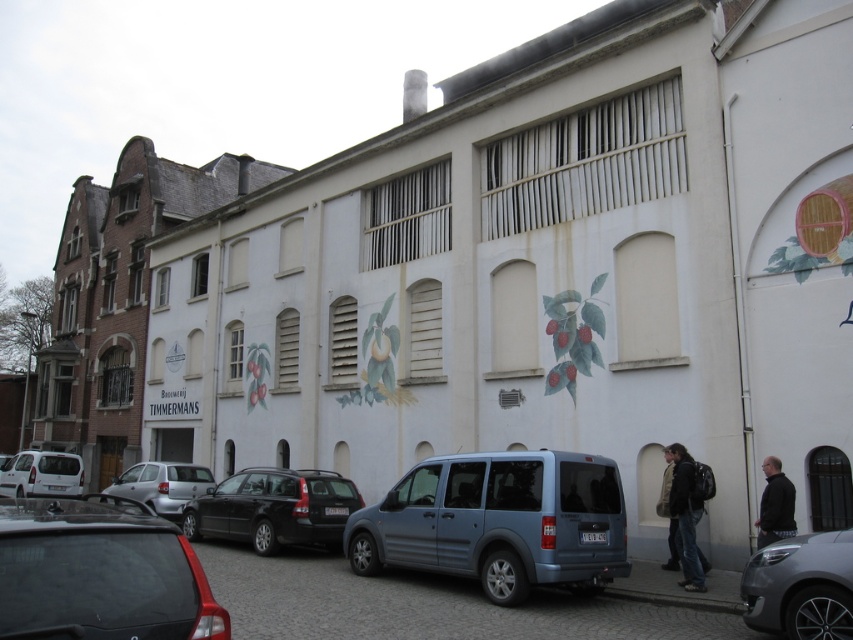
Is shiny black sedan at lower left in front of silver metallic car at lower left?

Yes, shiny black sedan at lower left is in front of silver metallic car at lower left.

Who is more distant from viewer, (25, 566) or (194, 480)?

The point (194, 480) is more distant.

Between point (161, 552) and point (160, 486), which one is positioned in front?

Point (161, 552) is in front.

Where is `shiny black sedan at lower left`? The image size is (853, 640). shiny black sedan at lower left is located at coordinates (99, 573).

Is satin silver van at lower right below white matte van at lower left?

No, satin silver van at lower right is not below white matte van at lower left.

The height and width of the screenshot is (640, 853). I want to click on satin silver van at lower right, so click(x=801, y=586).

The image size is (853, 640). I want to click on satin silver van at lower right, so click(801, 586).

Which is more to the left, black matte station wagon at center or leather jacket at lower right?

black matte station wagon at center

Between point (326, 497) and point (675, 538), which one is positioned behind?

The point (326, 497) is behind.

Between point (245, 476) and point (672, 484), which one is positioned in front?

Positioned in front is point (672, 484).

The height and width of the screenshot is (640, 853). Find the location of `black matte station wagon at center`. black matte station wagon at center is located at coordinates (274, 508).